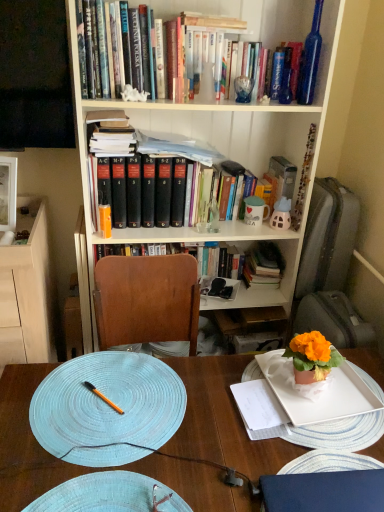
Question: Considering the relative positions of white matte plate at lower right, the third plate positioned from the left, and white paper notebook at center in the image provided, is white matte plate at lower right, the third plate positioned from the left, to the right of white paper notebook at center from the viewer's perspective?

Choices:
 (A) yes
 (B) no

Answer: (A)

Question: Is white matte plate at lower right, the third plate positioned from the left, oriented towards white paper notebook at center?

Choices:
 (A) yes
 (B) no

Answer: (A)

Question: From a real-world perspective, is white matte plate at lower right, acting as the 1th plate starting from the right, below white paper notebook at center?

Choices:
 (A) no
 (B) yes

Answer: (B)

Question: Considering the relative sizes of white matte plate at lower right, the third plate positioned from the left, and white paper notebook at center in the image provided, is white matte plate at lower right, the third plate positioned from the left, smaller than white paper notebook at center?

Choices:
 (A) no
 (B) yes

Answer: (A)

Question: Is white matte plate at lower right, the third plate positioned from the left, located outside white paper notebook at center?

Choices:
 (A) yes
 (B) no

Answer: (A)

Question: Is white ceramic mug at upper center next to white paper notebook at center?

Choices:
 (A) no
 (B) yes

Answer: (A)

Question: Considering the relative sizes of white ceramic mug at upper center and white paper notebook at center in the image provided, is white ceramic mug at upper center shorter than white paper notebook at center?

Choices:
 (A) yes
 (B) no

Answer: (B)

Question: From the image's perspective, would you say white ceramic mug at upper center is shown under white paper notebook at center?

Choices:
 (A) yes
 (B) no

Answer: (B)

Question: Can you confirm if white ceramic mug at upper center is bigger than white paper notebook at center?

Choices:
 (A) yes
 (B) no

Answer: (A)

Question: Can you confirm if white ceramic mug at upper center is taller than white paper notebook at center?

Choices:
 (A) no
 (B) yes

Answer: (B)

Question: From a real-world perspective, is white ceramic mug at upper center physically below white paper notebook at center?

Choices:
 (A) yes
 (B) no

Answer: (B)

Question: Is orange glossy pen at center far away from light wood cabinet at left?

Choices:
 (A) yes
 (B) no

Answer: (B)